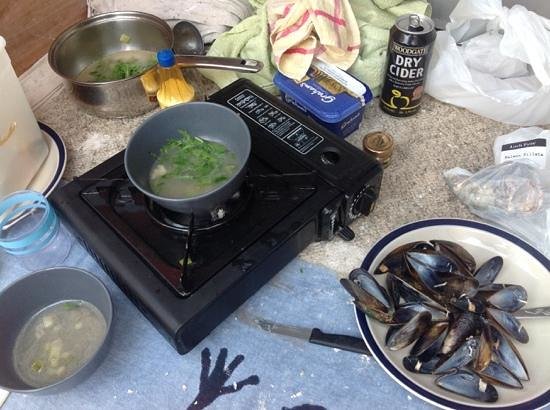
You are a GUI agent. You are given a task and a screenshot of the screen. Output one action in this format:
    pyautogui.click(x=<x>, y=<y>)
    Task: Click on the metal bowls
    The height and width of the screenshot is (410, 550).
    Given the screenshot: What is the action you would take?
    pyautogui.click(x=218, y=181), pyautogui.click(x=60, y=286)